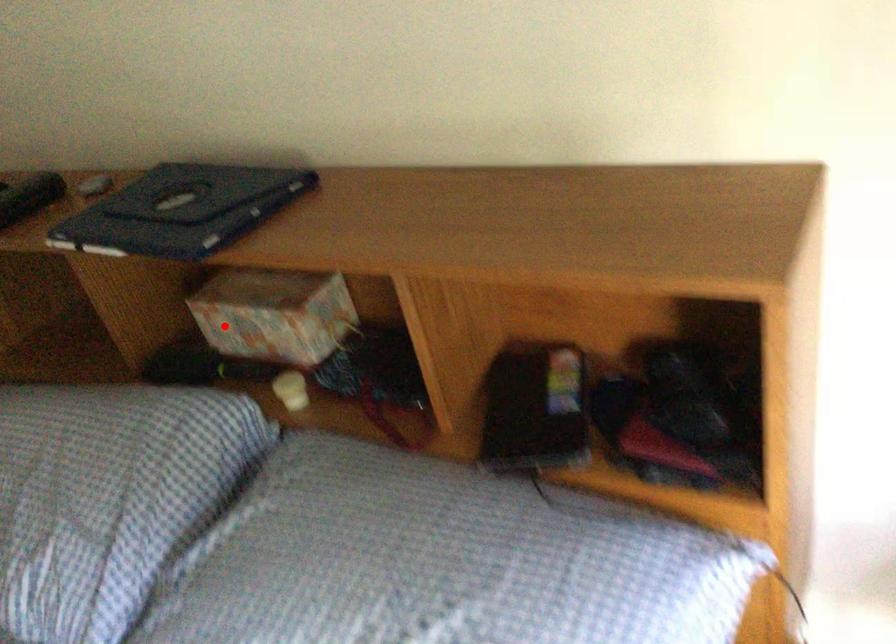
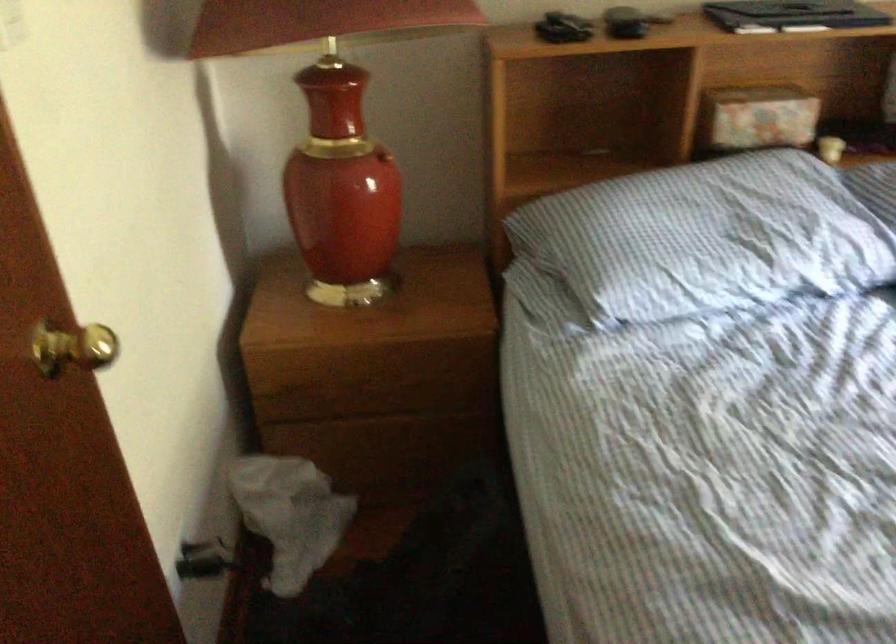
Question: I am providing you with two images of the same scene from different viewpoints. Image1 has a red point marked. In image2, the corresponding 3D location appears at what relative position? Reply with the corresponding letter.

Choices:
 (A) Closer
 (B) Farther

Answer: (B)